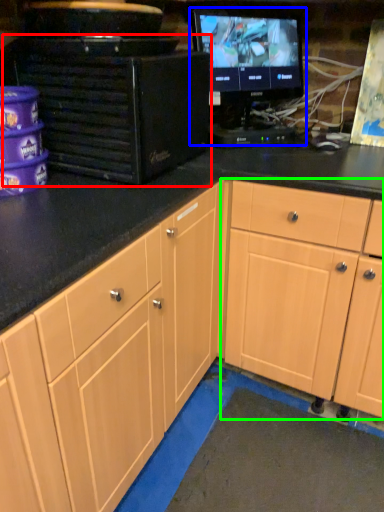
Question: Considering the real-world distances, which object is closest to desktop computer (highlighted by a red box)? computer monitor (highlighted by a blue box) or cabinetry (highlighted by a green box).

Choices:
 (A) computer monitor
 (B) cabinetry

Answer: (A)